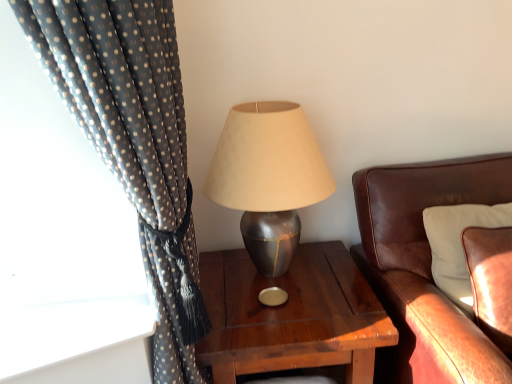
Question: Is metallic gray lamp at center next to brown leather couch at right?

Choices:
 (A) no
 (B) yes

Answer: (A)

Question: Is metallic gray lamp at center bigger than brown leather couch at right?

Choices:
 (A) no
 (B) yes

Answer: (A)

Question: From a real-world perspective, is metallic gray lamp at center located higher than brown leather couch at right?

Choices:
 (A) no
 (B) yes

Answer: (B)

Question: From the image's perspective, is metallic gray lamp at center beneath brown leather couch at right?

Choices:
 (A) yes
 (B) no

Answer: (B)

Question: Considering the relative sizes of metallic gray lamp at center and brown leather couch at right in the image provided, is metallic gray lamp at center smaller than brown leather couch at right?

Choices:
 (A) yes
 (B) no

Answer: (A)

Question: Is metallic gray lamp at center taller than brown leather couch at right?

Choices:
 (A) no
 (B) yes

Answer: (A)

Question: From a real-world perspective, is leather cushion at right on brown leather couch at right?

Choices:
 (A) yes
 (B) no

Answer: (A)

Question: Are leather cushion at right and brown leather couch at right far apart?

Choices:
 (A) yes
 (B) no

Answer: (B)

Question: Is leather cushion at right next to brown leather couch at right and touching it?

Choices:
 (A) no
 (B) yes

Answer: (A)

Question: Does leather cushion at right have a smaller size compared to brown leather couch at right?

Choices:
 (A) yes
 (B) no

Answer: (A)

Question: Does leather cushion at right have a larger size compared to brown leather couch at right?

Choices:
 (A) yes
 (B) no

Answer: (B)

Question: Is leather cushion at right to the right of brown leather couch at right from the viewer's perspective?

Choices:
 (A) no
 (B) yes

Answer: (A)

Question: Does polka dot fabric curtain at left appear on the left side of brown leather couch at right?

Choices:
 (A) no
 (B) yes

Answer: (B)